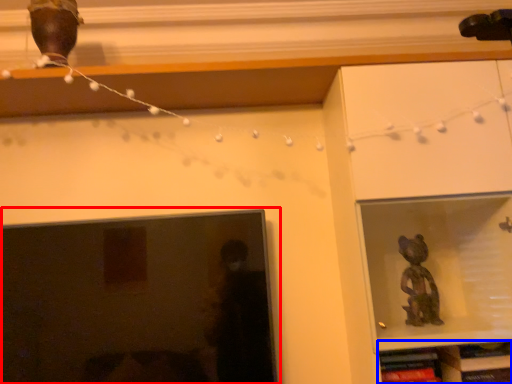
Question: Which object is further to the camera taking this photo, picture frame (highlighted by a red box) or shelf (highlighted by a blue box)?

Choices:
 (A) picture frame
 (B) shelf

Answer: (B)